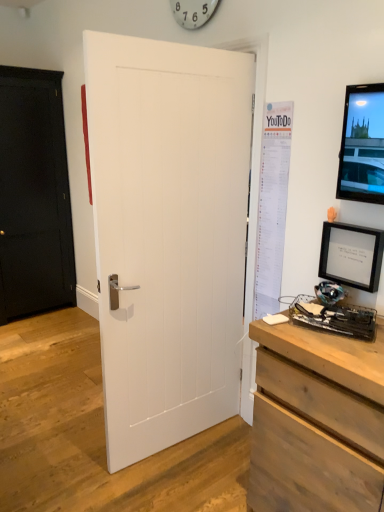
Where is `vacant area that lies to the right of white matte notepad at center`? Image resolution: width=384 pixels, height=512 pixels. vacant area that lies to the right of white matte notepad at center is located at coordinates (304, 329).